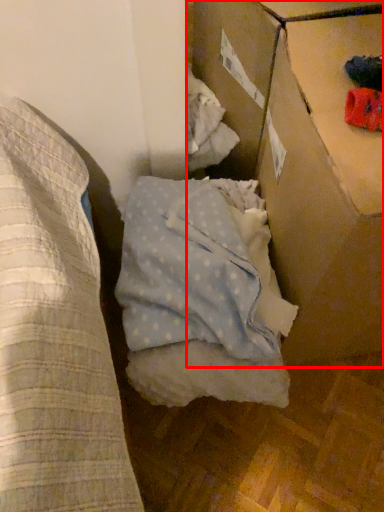
Question: From the image's perspective, where is cardboard box (annotated by the red box) located relative to sheet?

Choices:
 (A) below
 (B) above

Answer: (B)